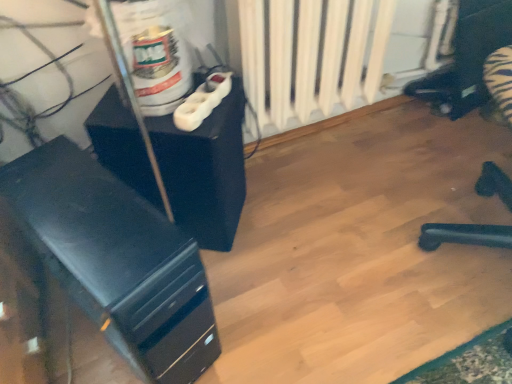
Question: Could you tell me if white plastic plug at upper center is turned towards matte black cabinet at center-left, which appears as the second furniture when ordered from the bottom?

Choices:
 (A) yes
 (B) no

Answer: (B)

Question: Does white plastic plug at upper center lie behind matte black cabinet at center-left, which appears as the second furniture when ordered from the bottom?

Choices:
 (A) no
 (B) yes

Answer: (B)

Question: Can you confirm if white plastic plug at upper center is thinner than matte black cabinet at center-left, placed as the first furniture when sorted from top to bottom?

Choices:
 (A) no
 (B) yes

Answer: (B)

Question: Is there a large distance between white plastic plug at upper center and matte black cabinet at center-left, placed as the first furniture when sorted from top to bottom?

Choices:
 (A) no
 (B) yes

Answer: (A)

Question: From the image's perspective, is white plastic plug at upper center above matte black cabinet at center-left, which appears as the second furniture when ordered from the bottom?

Choices:
 (A) no
 (B) yes

Answer: (B)

Question: Is matte black cabinet at center-left, which appears as the second furniture when ordered from the bottom, bigger or smaller than black matte computer tower at left, which is counted as the 2th furniture, starting from the top?

Choices:
 (A) small
 (B) big

Answer: (A)

Question: Considering the relative positions of matte black cabinet at center-left, which appears as the second furniture when ordered from the bottom, and black matte computer tower at left, which is counted as the 2th furniture, starting from the top, in the image provided, is matte black cabinet at center-left, which appears as the second furniture when ordered from the bottom, to the left or to the right of black matte computer tower at left, which is counted as the 2th furniture, starting from the top,?

Choices:
 (A) right
 (B) left

Answer: (A)

Question: Considering the positions of matte black cabinet at center-left, which appears as the second furniture when ordered from the bottom, and black matte computer tower at left, which ranks as the 1th furniture in bottom-to-top order, in the image, is matte black cabinet at center-left, which appears as the second furniture when ordered from the bottom, wider or thinner than black matte computer tower at left, which ranks as the 1th furniture in bottom-to-top order,?

Choices:
 (A) thin
 (B) wide

Answer: (A)

Question: Is matte black cabinet at center-left, placed as the first furniture when sorted from top to bottom, taller or shorter than black matte computer tower at left, which is counted as the 2th furniture, starting from the top?

Choices:
 (A) short
 (B) tall

Answer: (A)

Question: In terms of height, does black matte computer tower at left, which is counted as the 2th furniture, starting from the top, look taller or shorter compared to white matte radiator at center?

Choices:
 (A) tall
 (B) short

Answer: (B)

Question: Is black matte computer tower at left, which ranks as the 1th furniture in bottom-to-top order, bigger or smaller than white matte radiator at center?

Choices:
 (A) big
 (B) small

Answer: (B)

Question: In the image, is black matte computer tower at left, which is counted as the 2th furniture, starting from the top, positioned in front of or behind white matte radiator at center?

Choices:
 (A) front
 (B) behind

Answer: (A)

Question: From the image's perspective, is black matte computer tower at left, which ranks as the 1th furniture in bottom-to-top order, located above or below white matte radiator at center?

Choices:
 (A) above
 (B) below

Answer: (B)

Question: From their relative heights in the image, would you say white matte radiator at center is taller or shorter than black matte computer tower at left, which ranks as the 1th furniture in bottom-to-top order?

Choices:
 (A) tall
 (B) short

Answer: (A)

Question: Based on their sizes in the image, would you say white matte radiator at center is bigger or smaller than black matte computer tower at left, which ranks as the 1th furniture in bottom-to-top order?

Choices:
 (A) big
 (B) small

Answer: (A)